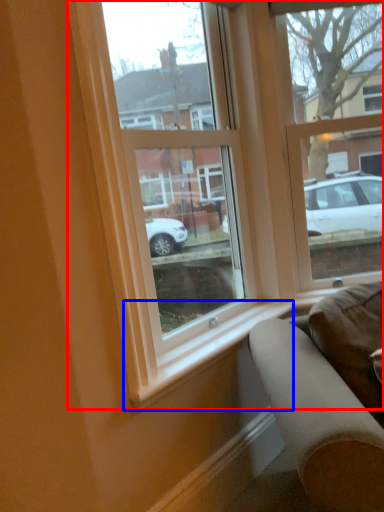
Question: Which of the following is the closest to the observer, window (highlighted by a red box) or window sill (highlighted by a blue box)?

Choices:
 (A) window
 (B) window sill

Answer: (A)